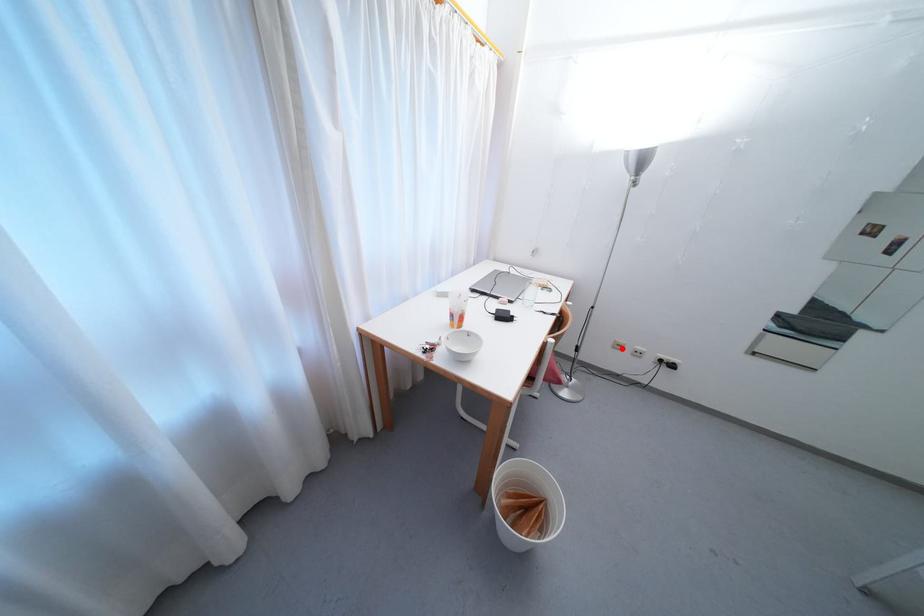
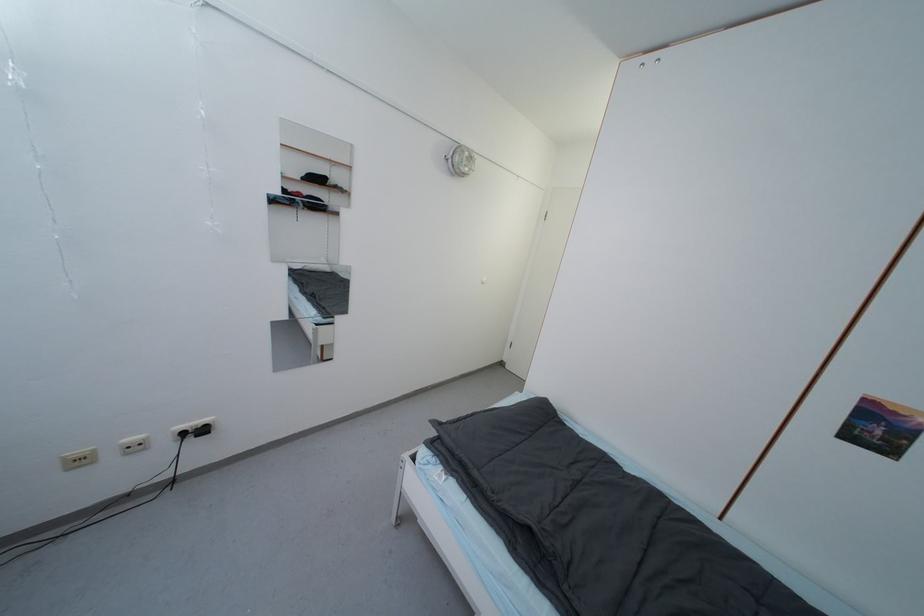
In the second image, find the point that corresponds to the highlighted location in the first image.

(83, 464)